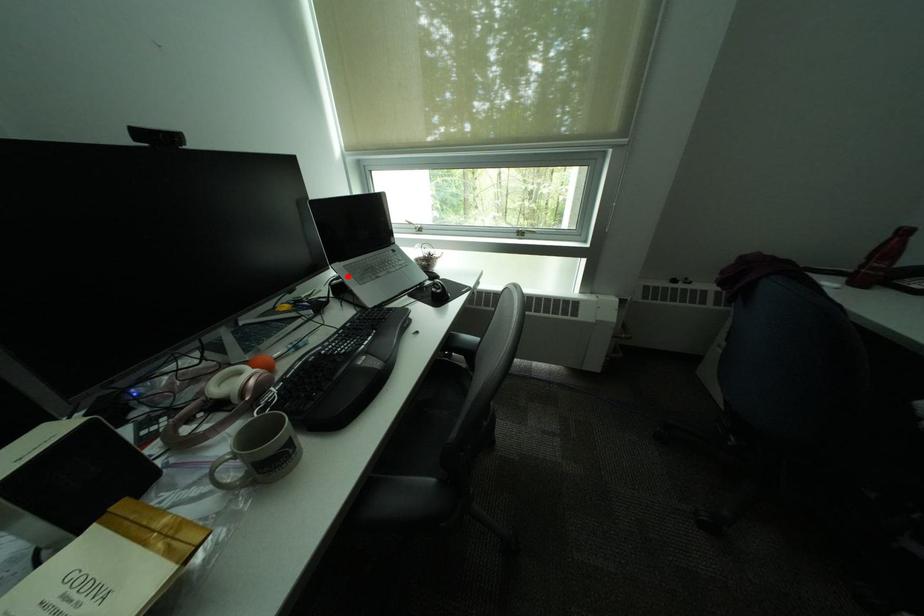
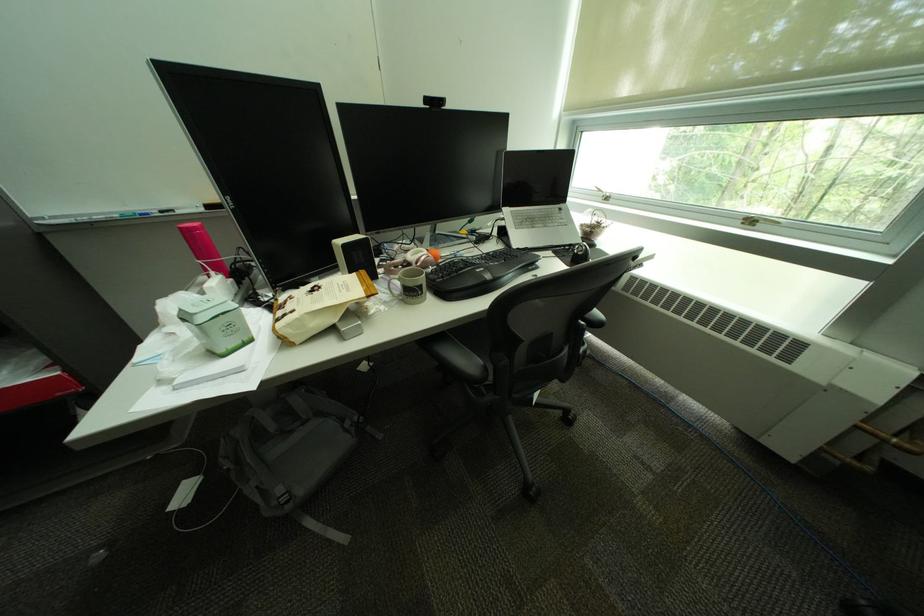
Question: I am providing you with two images of the same scene from different viewpoints. A red point is shown in image1. For the corresponding object point in image2, is it positioned nearer or farther from the camera?

Choices:
 (A) Nearer
 (B) Farther

Answer: (A)